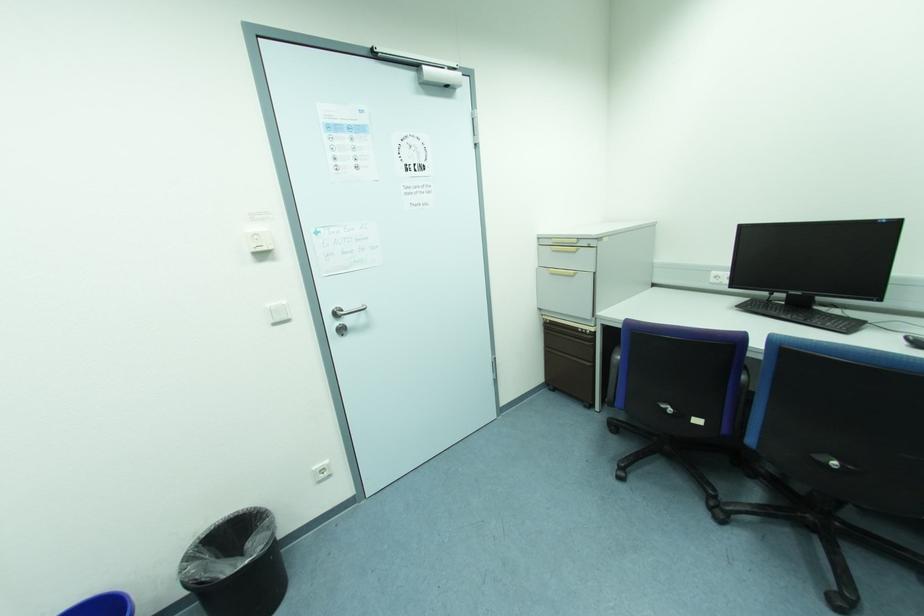
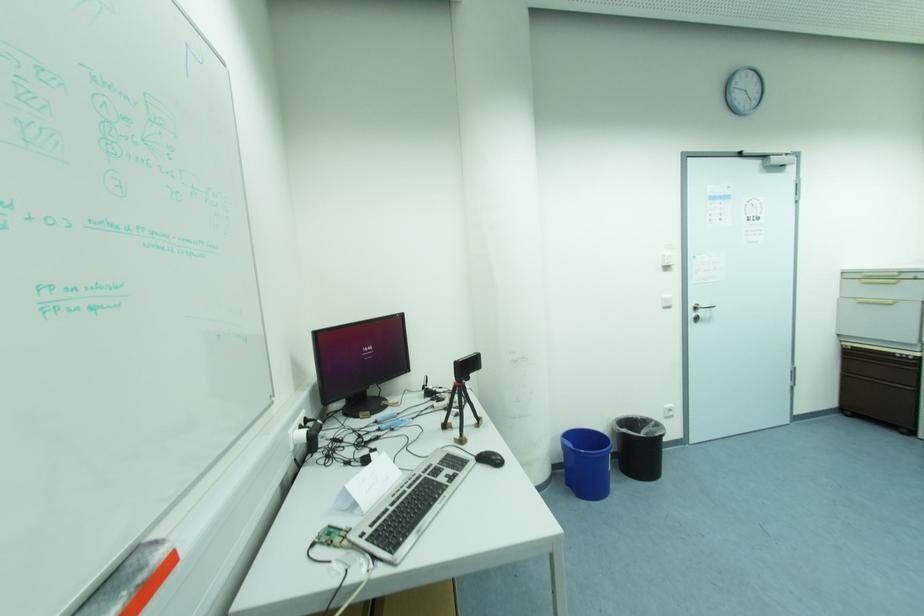
Question: I am providing you with two images of the same scene from different viewpoints. Please identify which objects are invisible in image2.

Choices:
 (A) silver door handle
 (B) folded white paper
 (C) black webcam
 (D) none of these

Answer: (D)